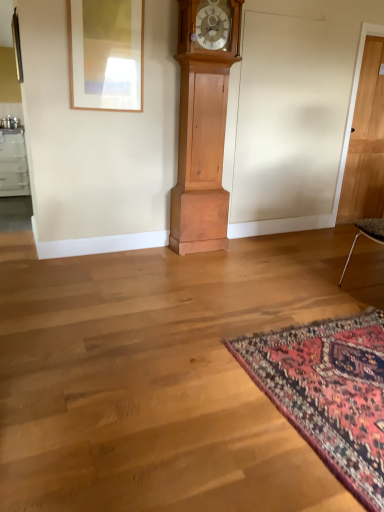
Question: Considering the positions of light brown wood grandfather clock at center and matte wooden picture frame at upper left in the image, is light brown wood grandfather clock at center wider or thinner than matte wooden picture frame at upper left?

Choices:
 (A) thin
 (B) wide

Answer: (B)

Question: Is light brown wood grandfather clock at center bigger or smaller than matte wooden picture frame at upper left?

Choices:
 (A) big
 (B) small

Answer: (A)

Question: Estimate the real-world distances between objects in this image. Which object is farther from the carpet with intricate patterns at lower right?

Choices:
 (A) matte wooden picture frame at upper left
 (B) light brown wood grandfather clock at center
 (C) light brown wooden door at right

Answer: (C)

Question: Which object is positioned farthest from the light brown wood grandfather clock at center?

Choices:
 (A) light brown wooden door at right
 (B) carpet with intricate patterns at lower right
 (C) matte wooden picture frame at upper left

Answer: (B)